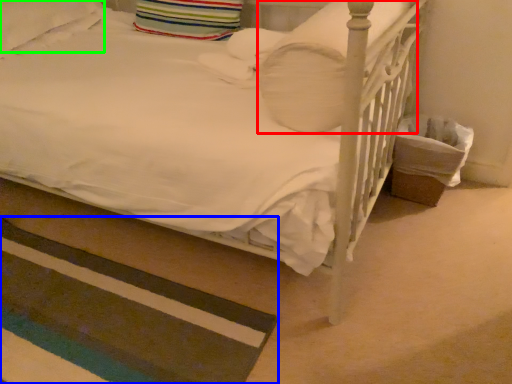
Question: Based on their relative distances, which object is nearer to pillow (highlighted by a red box)? Choose from mat (highlighted by a blue box) and pillow (highlighted by a green box).

Choices:
 (A) mat
 (B) pillow

Answer: (A)